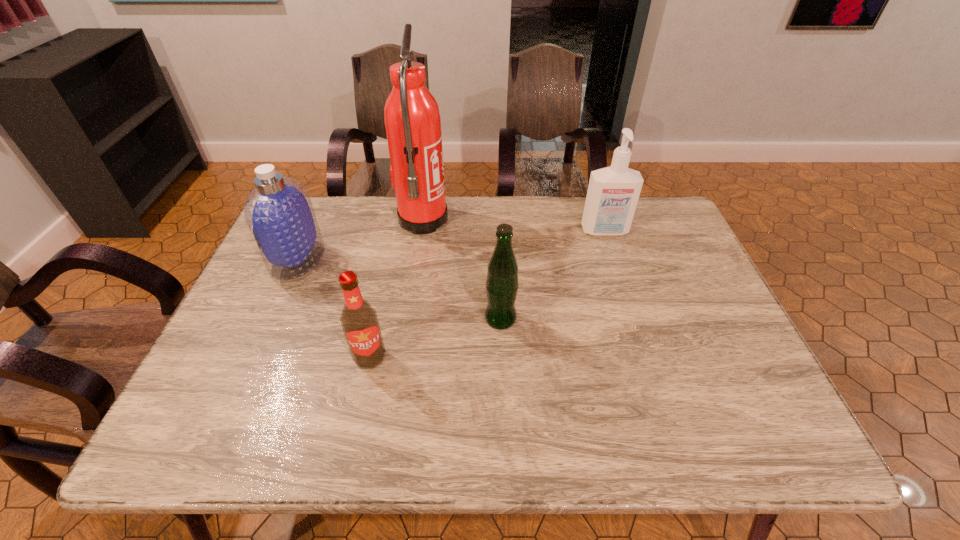
Locate an element on the screen. The height and width of the screenshot is (540, 960). free spot located 0.050m on the left of the farther beer bottle is located at coordinates (464, 319).

Where is `free location located on the right of the nearer beer bottle`? This screenshot has width=960, height=540. free location located on the right of the nearer beer bottle is located at coordinates (425, 356).

Locate an element on the screen. fire extinguisher that is at the far edge is located at coordinates (412, 119).

The width and height of the screenshot is (960, 540). I want to click on object at the left edge, so click(x=279, y=213).

The image size is (960, 540). Find the location of `object that is at the far left corner`. object that is at the far left corner is located at coordinates (279, 213).

The height and width of the screenshot is (540, 960). I want to click on vacant space at the far edge of the desktop, so click(347, 218).

You are a GUI agent. You are given a task and a screenshot of the screen. Output one action in this format:
    pyautogui.click(x=<x>, y=<y>)
    Task: Click on the vacant position at the near edge of the desktop
    The image size is (960, 540).
    Given the screenshot: What is the action you would take?
    pyautogui.click(x=404, y=446)

At what (x,y) coordinates should I click in order to perform the action: click on vacant space at the left edge of the desktop. Please return your answer as a coordinate pair (x, y). The height and width of the screenshot is (540, 960). Looking at the image, I should click on (270, 321).

At what (x,y) coordinates should I click in order to perform the action: click on vacant space at the right edge. Please return your answer as a coordinate pair (x, y). The height and width of the screenshot is (540, 960). Looking at the image, I should click on (706, 364).

Find the location of a particular element. The height and width of the screenshot is (540, 960). blank area at the far right corner is located at coordinates (664, 237).